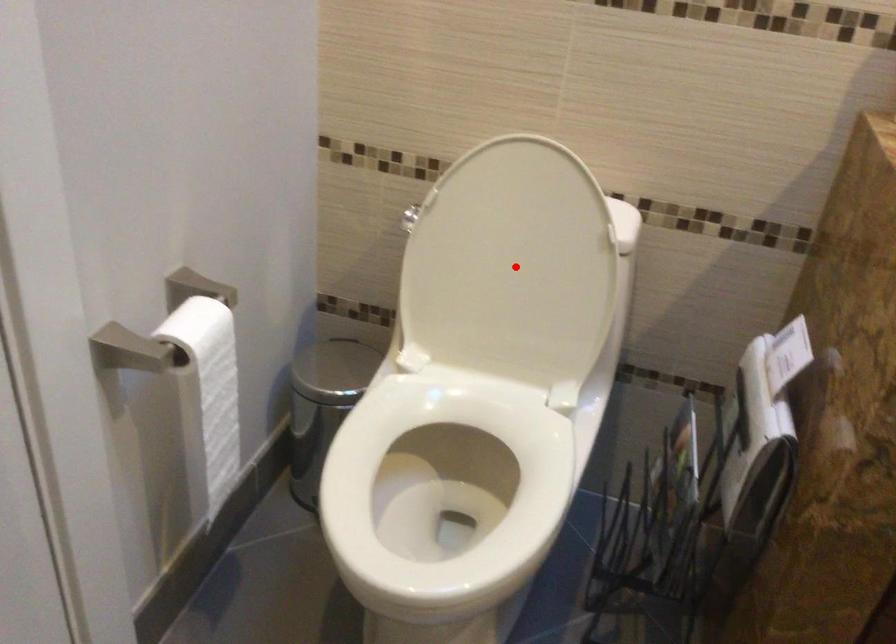
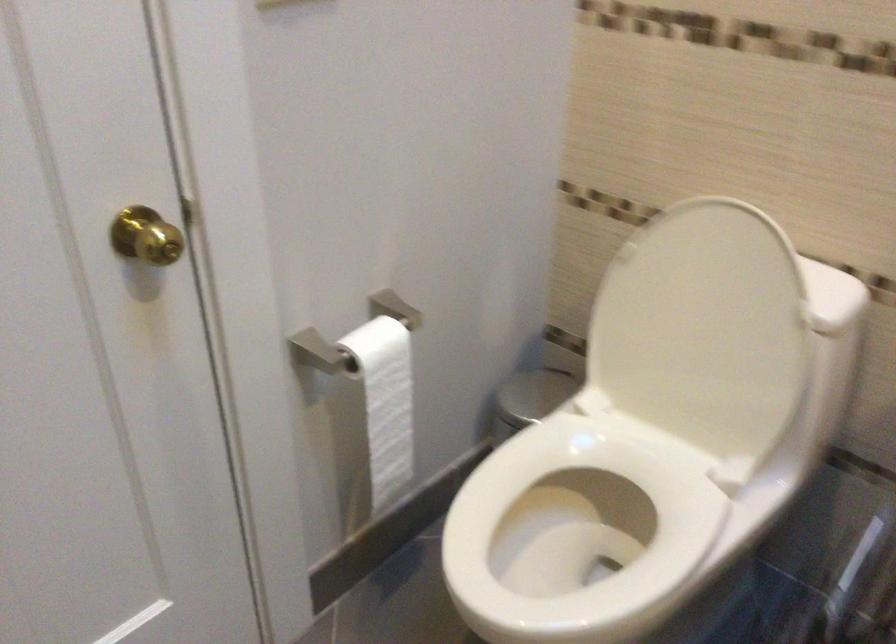
Find the pixel in the second image that matches the highlighted location in the first image.

(702, 330)